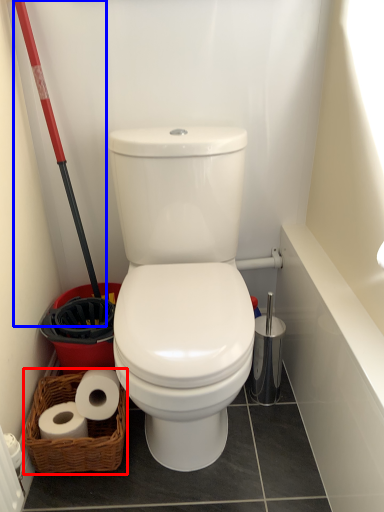
Question: Which object is closer to the camera taking this photo, basket (highlighted by a red box) or shovel (highlighted by a blue box)?

Choices:
 (A) basket
 (B) shovel

Answer: (B)